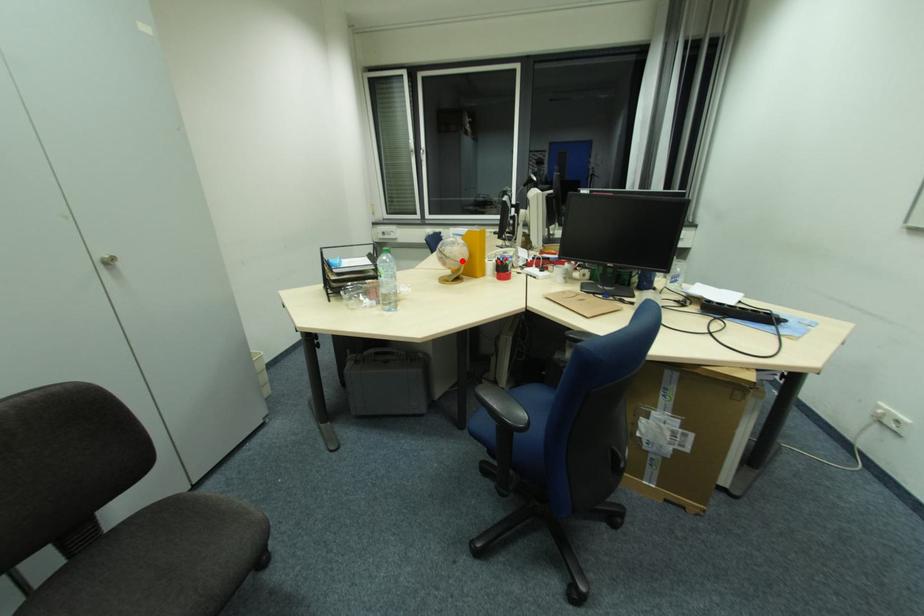
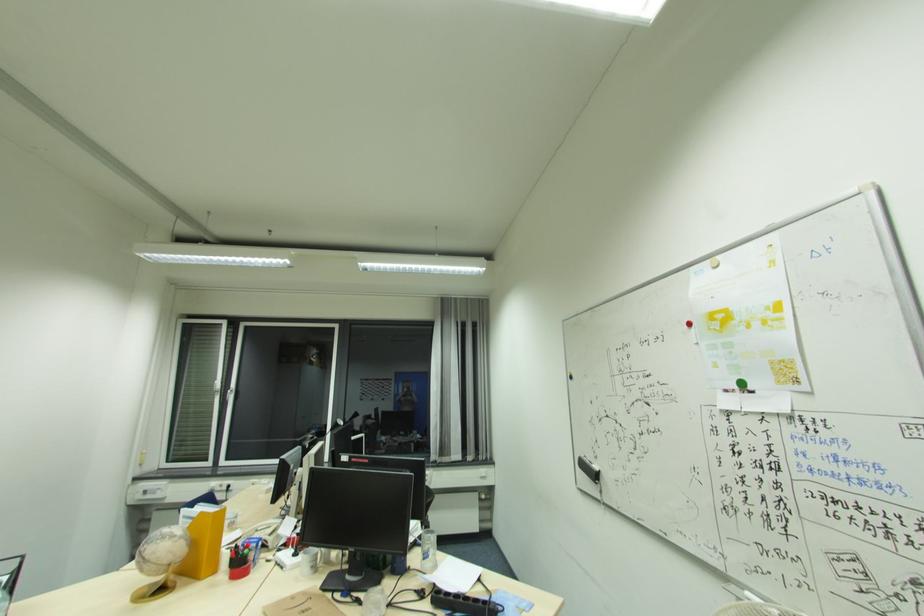
Question: I am providing you with two images of the same scene from different viewpoints. A red point is marked on the first image. Can you still see the location of the red point in image 2?

Choices:
 (A) Yes
 (B) No

Answer: (A)